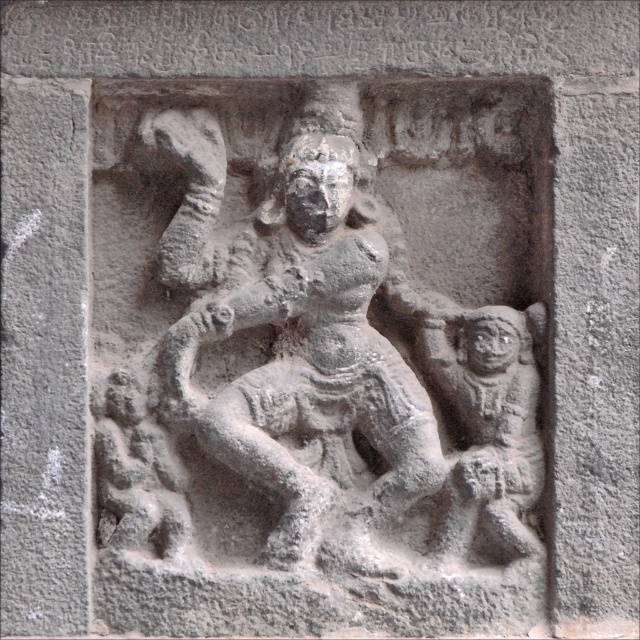
Can you confirm if gray stone sculpture at center is wider than gray stone monkey at right?

Yes.

Does gray stone sculpture at center appear over gray stone monkey at right?

Correct, gray stone sculpture at center is located above gray stone monkey at right.

Identify the location of gray stone sculpture at center. The image size is (640, 640). (317, 365).